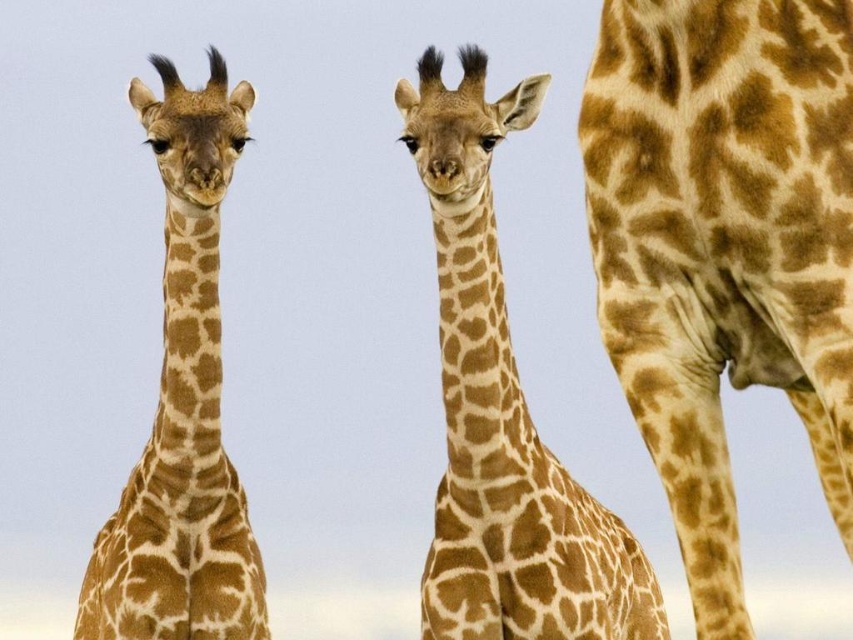
You are a wildlife photographer aiming to capture both the spotted fur giraffe at right and the spotted brown giraffe at center in a single frame. Which giraffe is located more to the right side of the image?

The spotted fur giraffe at right is positioned on the right side of the spotted brown giraffe at center, so it is more to the right in the image.

You are standing in front of a painting of two giraffes. The scene shows a spotted fur giraffe at center and a spotted brown giraffe at center. Which giraffe is positioned to the right of the other?

The spotted fur giraffe at center is positioned to the right of the spotted brown giraffe at center.

You are a photographer trying to capture both the spotted fur giraffe at center and the spotted brown giraffe at center in a single shot. Based on their positions, which giraffe is blocking the view of the other?

The spotted fur giraffe at center is positioned under the spotted brown giraffe at center, so the spotted brown giraffe at center is blocking the view of the spotted fur giraffe at center.